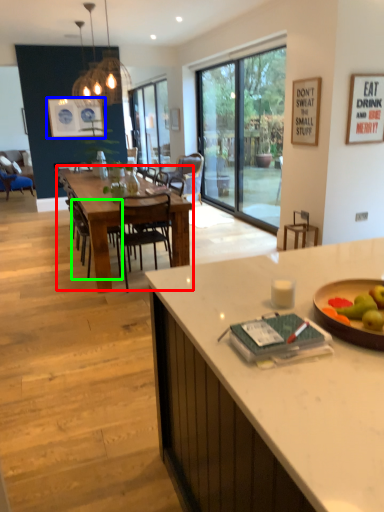
Question: Considering the real-world distances, which object is farthest from kitchen & dining room table (highlighted by a red box)? painting (highlighted by a blue box) or chair (highlighted by a green box)?

Choices:
 (A) painting
 (B) chair

Answer: (A)